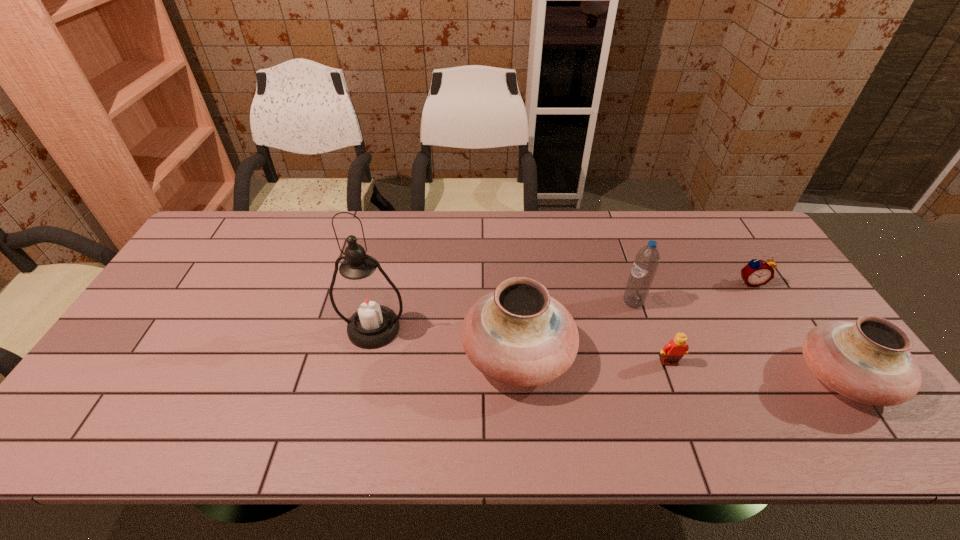
This screenshot has width=960, height=540. In order to click on vacant place for an extra pottery on the left in this screenshot , I will do `click(220, 334)`.